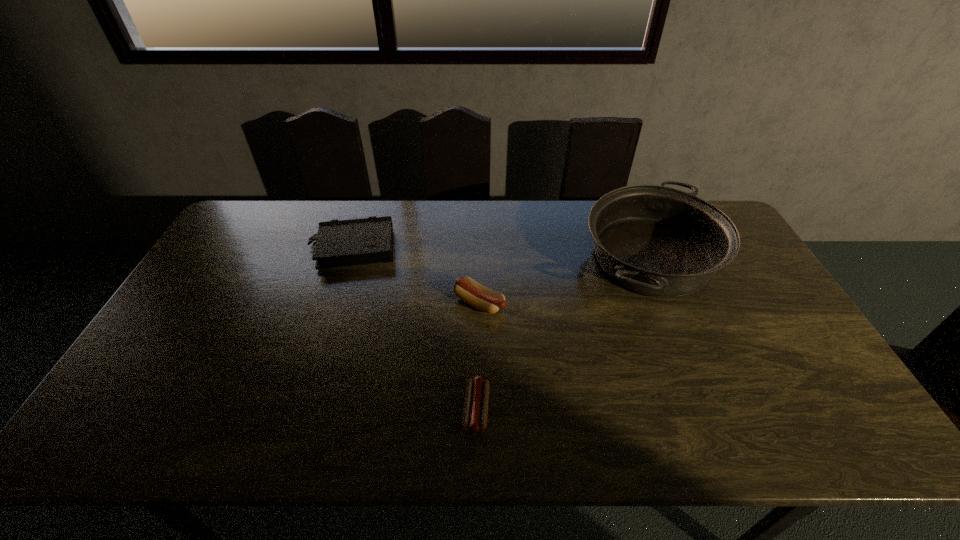
Find the location of a particular element. The width and height of the screenshot is (960, 540). blank region between the pan and the Bible is located at coordinates (501, 254).

The height and width of the screenshot is (540, 960). What are the coordinates of `empty space that is in between the Bible and the pan` in the screenshot? It's located at (501, 254).

This screenshot has height=540, width=960. What are the coordinates of `free space that is in between the rightmost object and the shorter sausage` in the screenshot? It's located at (564, 334).

The width and height of the screenshot is (960, 540). I want to click on vacant point located between the Bible and the rightmost object, so click(501, 254).

This screenshot has width=960, height=540. Identify the location of unoccupied position between the Bible and the taller sausage. (416, 276).

The height and width of the screenshot is (540, 960). I want to click on vacant point located between the nearer sausage and the taller sausage, so click(478, 356).

The width and height of the screenshot is (960, 540). Identify the location of empty space that is in between the farther sausage and the pan. (564, 281).

Find the location of a particular element. The image size is (960, 540). free space that is in between the Bible and the pan is located at coordinates (501, 254).

Locate an element on the screen. This screenshot has height=540, width=960. vacant space that's between the shorter sausage and the farther sausage is located at coordinates (478, 356).

Find the location of a particular element. object that is the nearest to the taller sausage is located at coordinates (475, 413).